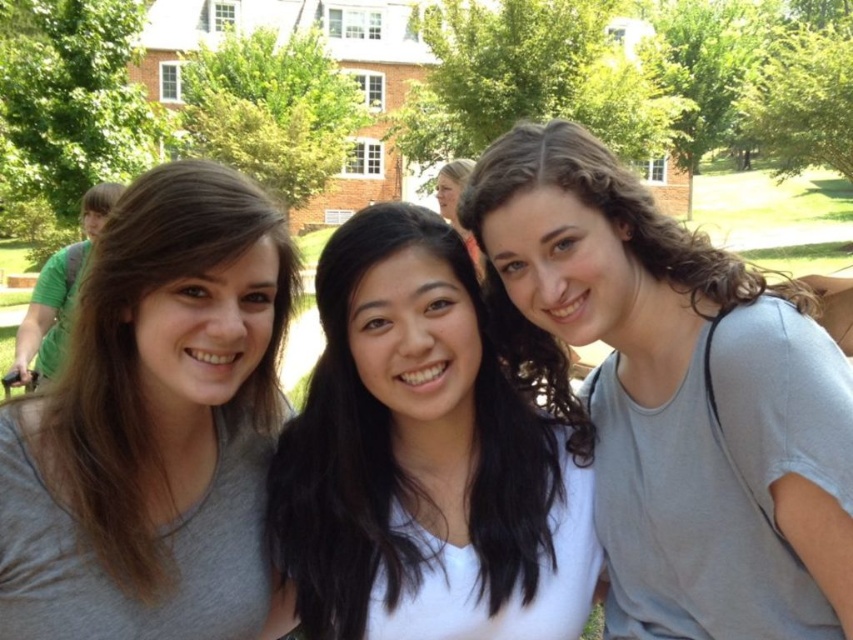
You are standing at the point with coordinates point (286, 307) and want to move to the point with coordinates point (556, 198). Which direction should you move in to reach your destination?

You should move forward to reach point (556, 198) because it is in front of point (286, 307).

You are a photographer trying to adjust the lighting for a group photo. You notice the matte gray shirt at left and the white matte shirt at center. Which person should you position closer to the light source to ensure their clothing is well lit, considering their height difference?

The matte gray shirt at left is much taller than the white matte shirt at center. Position the white matte shirt at center closer to the light source since it is shorter and may need more direct light to ensure its white top is well lit.